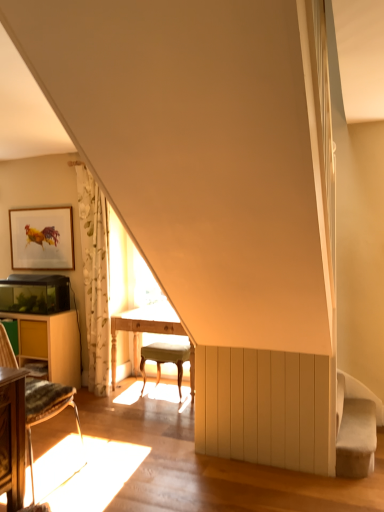
Question: Is wooden chair at lower left aimed at light wood table at center, which appears as the 2th table when viewed from the left?

Choices:
 (A) yes
 (B) no

Answer: (B)

Question: Is wooden chair at lower left positioned behind light wood table at center, which is counted as the first table, starting from the right?

Choices:
 (A) no
 (B) yes

Answer: (A)

Question: Can you confirm if wooden chair at lower left is taller than light wood table at center, which is counted as the first table, starting from the right?

Choices:
 (A) no
 (B) yes

Answer: (B)

Question: Is wooden chair at lower left thinner than light wood table at center, which is counted as the first table, starting from the right?

Choices:
 (A) yes
 (B) no

Answer: (B)

Question: Would you say wooden chair at lower left contains light wood table at center, which appears as the 2th table when viewed from the left?

Choices:
 (A) yes
 (B) no

Answer: (B)

Question: From a real-world perspective, is light beige fabric stool at center above or below velvet beige swivel chair at lower right?

Choices:
 (A) above
 (B) below

Answer: (A)

Question: In terms of size, does light beige fabric stool at center appear bigger or smaller than velvet beige swivel chair at lower right?

Choices:
 (A) small
 (B) big

Answer: (B)

Question: Considering the positions of light beige fabric stool at center and velvet beige swivel chair at lower right in the image, is light beige fabric stool at center wider or thinner than velvet beige swivel chair at lower right?

Choices:
 (A) thin
 (B) wide

Answer: (B)

Question: In terms of height, does light beige fabric stool at center look taller or shorter compared to velvet beige swivel chair at lower right?

Choices:
 (A) tall
 (B) short

Answer: (A)

Question: Based on their sizes in the image, would you say white floral fabric curtain at left is bigger or smaller than wooden chair at lower left?

Choices:
 (A) big
 (B) small

Answer: (B)

Question: Looking at their shapes, would you say white floral fabric curtain at left is wider or thinner than wooden chair at lower left?

Choices:
 (A) thin
 (B) wide

Answer: (A)

Question: From the image's perspective, is white floral fabric curtain at left above or below wooden chair at lower left?

Choices:
 (A) below
 (B) above

Answer: (B)

Question: Is point (96, 197) closer or farther from the camera than point (51, 415)?

Choices:
 (A) farther
 (B) closer

Answer: (A)

Question: Is point (119, 329) closer or farther from the camera than point (29, 441)?

Choices:
 (A) closer
 (B) farther

Answer: (B)

Question: Is light wood table at center, which appears as the 2th table when viewed from the left, wider or thinner than wooden chair at lower left?

Choices:
 (A) thin
 (B) wide

Answer: (A)